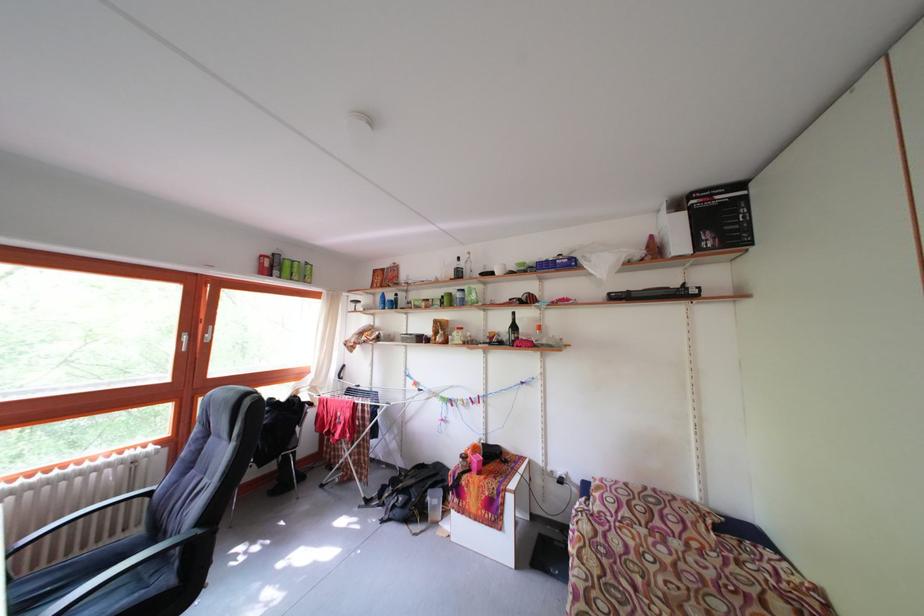
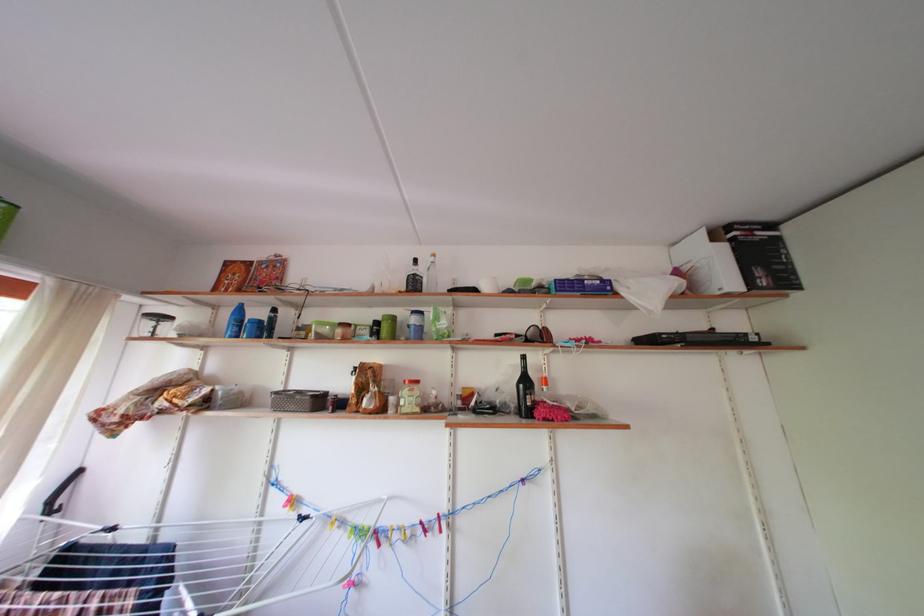
In the second image, find the point that corresponds to the point at 469,270 in the first image.

(430, 276)